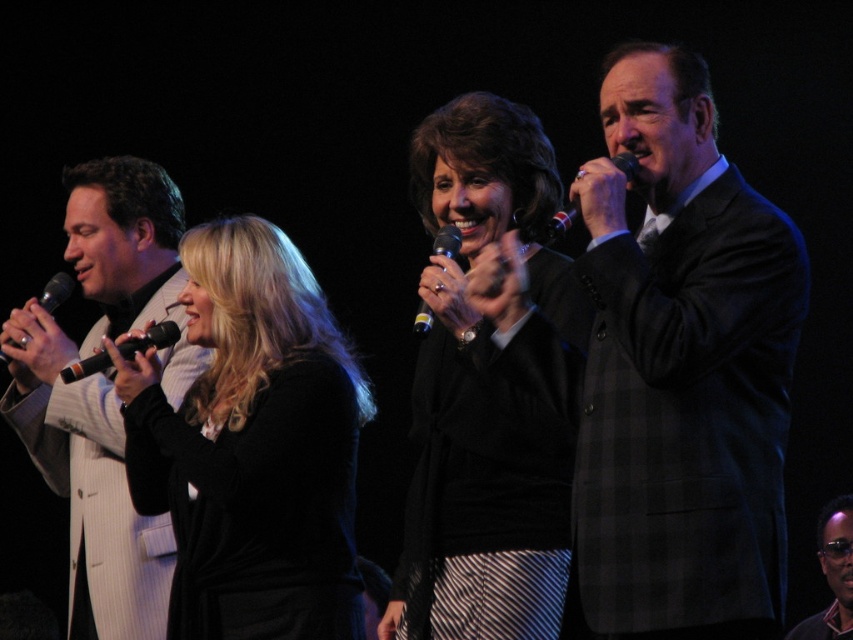
Does black matte sweater at center appear over black plastic microphone at left?

No.

Is black matte sweater at center bigger than black plastic microphone at left?

Yes.

Describe the element at coordinates (479, 401) in the screenshot. I see `black matte sweater at center` at that location.

Where is `black matte sweater at center`? The height and width of the screenshot is (640, 853). black matte sweater at center is located at coordinates (479, 401).

Describe the element at coordinates (253, 445) in the screenshot. I see `black velvet dress at center` at that location.

The width and height of the screenshot is (853, 640). What do you see at coordinates (253, 445) in the screenshot?
I see `black velvet dress at center` at bounding box center [253, 445].

This screenshot has width=853, height=640. What are the coordinates of `black velvet dress at center` in the screenshot? It's located at (253, 445).

Between black velvet dress at center and black plastic microphone at upper right, which one appears on the right side from the viewer's perspective?

black plastic microphone at upper right

Can you confirm if black velvet dress at center is positioned below black plastic microphone at upper right?

Yes.

Locate an element on the screen. black velvet dress at center is located at coordinates (253, 445).